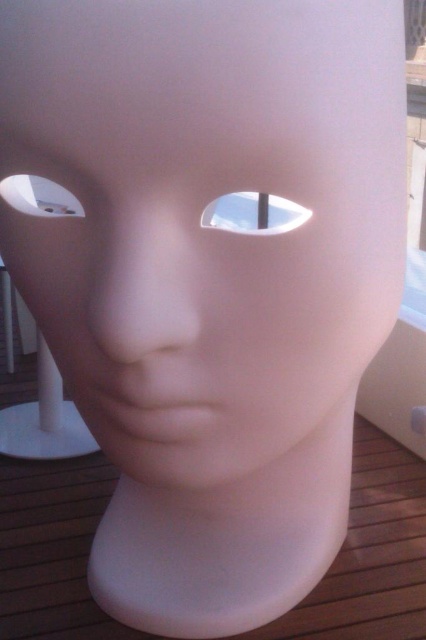
Is white glossy eye at center positioned at the back of white matte hole at left?

That is True.

Describe the element at coordinates (253, 212) in the screenshot. I see `white glossy eye at center` at that location.

The width and height of the screenshot is (426, 640). I want to click on white glossy eye at center, so click(x=253, y=212).